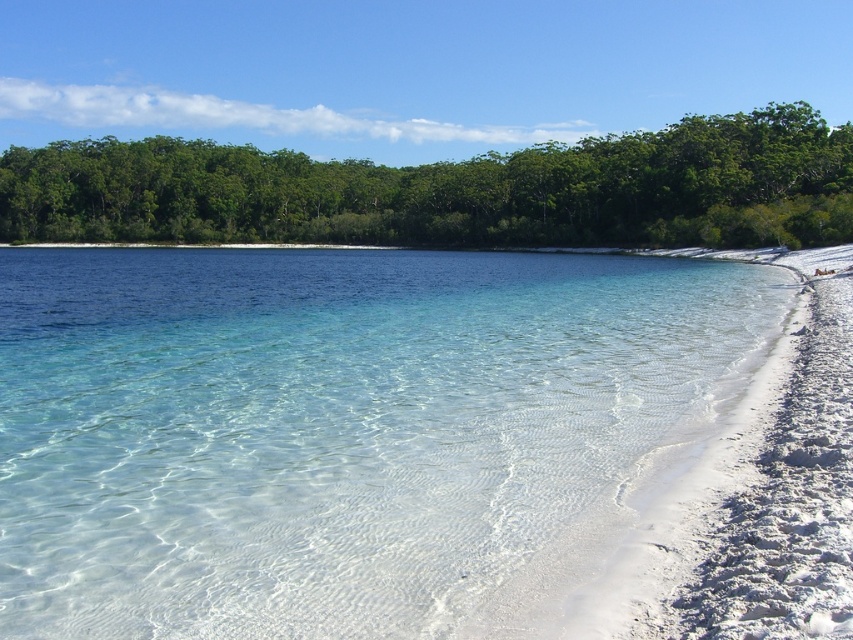
Who is more forward, (705,422) or (10,161)?

Point (705,422) is more forward.

The image size is (853, 640). I want to click on clear water at center, so click(338, 429).